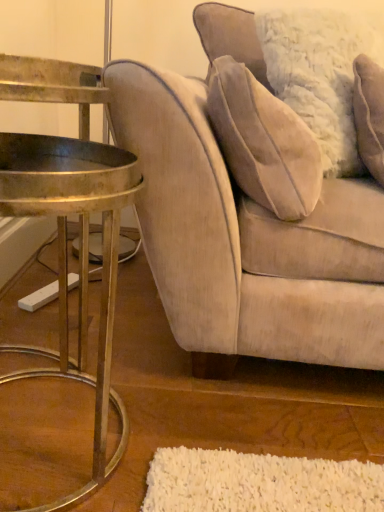
Question: Considering the positions of velvet beige couch at right and gold metallic table at left in the image, is velvet beige couch at right taller or shorter than gold metallic table at left?

Choices:
 (A) tall
 (B) short

Answer: (A)

Question: Looking at the image, does velvet beige couch at right seem bigger or smaller compared to gold metallic table at left?

Choices:
 (A) small
 (B) big

Answer: (B)

Question: Which is farther from the velvet beige couch at right?

Choices:
 (A) velvet beige pillow at upper right
 (B) gold metallic table at left

Answer: (A)

Question: Based on their relative distances, which object is nearer to the gold metallic table at left?

Choices:
 (A) velvet beige couch at right
 (B) velvet beige pillow at upper right

Answer: (A)